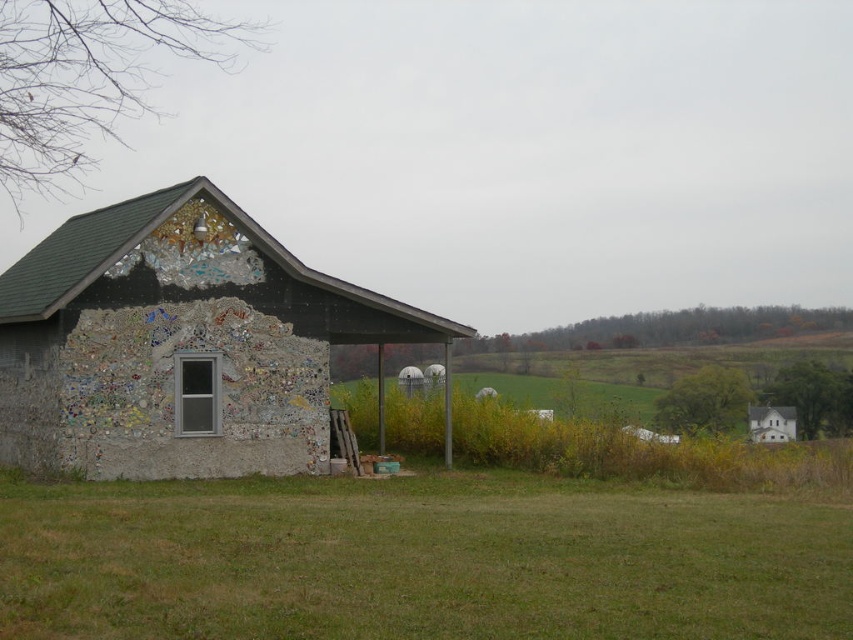
You are standing at the entrance of the barn and see two points marked on the ground. The first point is at coordinate point(386,600) and the second is at point(318,424). Which point is closer to you?

Point(386,600) is in front of point(318,424), so it is closer to you.